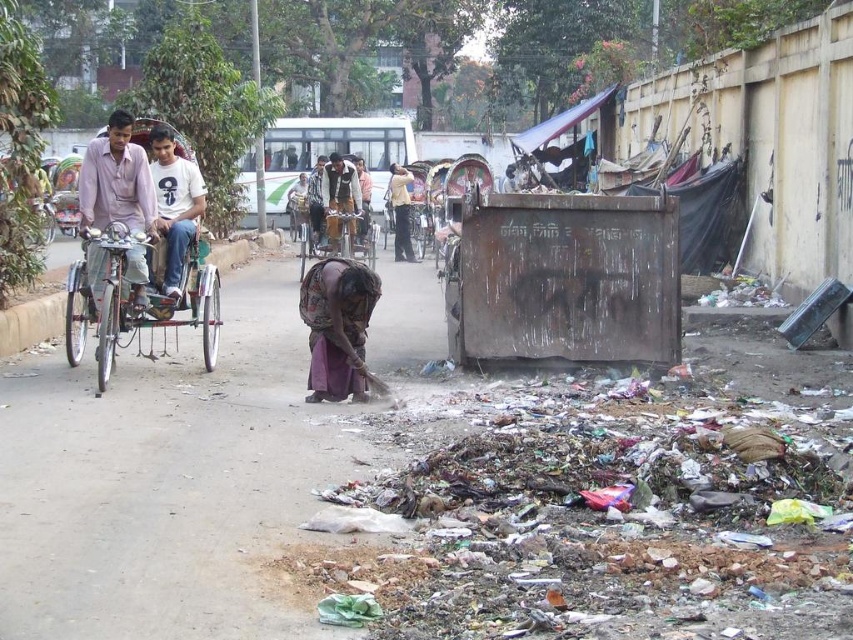
Who is more distant from viewer, (105,317) or (310,289)?

The point (310,289) is behind.

Where is `metallic silver rickshaw at left`? The image size is (853, 640). metallic silver rickshaw at left is located at coordinates (132, 298).

Is point (117, 317) positioned behind point (172, 289)?

No.

Which is more to the left, metallic silver rickshaw at left or white cotton shirt at center?

metallic silver rickshaw at left is more to the left.

In order to click on metallic silver rickshaw at left in this screenshot , I will do `click(132, 298)`.

Which is below, metallic silver rickshaw at left or dark brown leather jacket at center?

Positioned lower is metallic silver rickshaw at left.

Which is in front, point (175, 321) or point (340, 193)?

Positioned in front is point (175, 321).

Identify the location of metallic silver rickshaw at left. (132, 298).